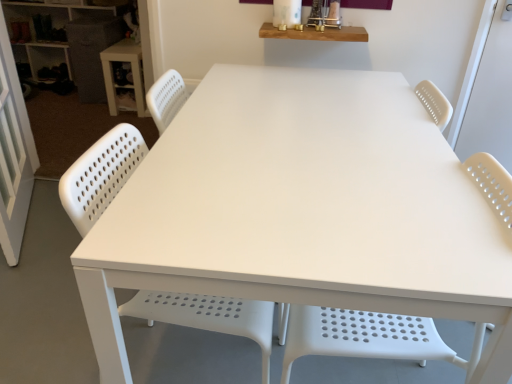
Question: Considering the relative sizes of matte white shelves at upper left and white perforated plastic chair at lower left, which is the second chair in right-to-left order, in the image provided, is matte white shelves at upper left smaller than white perforated plastic chair at lower left, which is the second chair in right-to-left order,?

Choices:
 (A) yes
 (B) no

Answer: (B)

Question: Can you see matte white shelves at upper left touching white perforated plastic chair at lower left, which is the second chair in right-to-left order?

Choices:
 (A) yes
 (B) no

Answer: (B)

Question: Is the depth of matte white shelves at upper left less than that of white perforated plastic chair at lower left, which is the second chair in right-to-left order?

Choices:
 (A) no
 (B) yes

Answer: (A)

Question: From a real-world perspective, is matte white shelves at upper left located higher than white perforated plastic chair at lower left, which is the second chair in right-to-left order?

Choices:
 (A) no
 (B) yes

Answer: (A)

Question: Does matte white shelves at upper left have a greater height compared to white perforated plastic chair at lower left, the 1th chair from the left?

Choices:
 (A) yes
 (B) no

Answer: (B)

Question: Is matte white shelves at upper left taller or shorter than white plastic table at upper left?

Choices:
 (A) tall
 (B) short

Answer: (A)

Question: Which is correct: matte white shelves at upper left is inside white plastic table at upper left, or outside of it?

Choices:
 (A) inside
 (B) outside

Answer: (B)

Question: Considering their positions, is matte white shelves at upper left located in front of or behind white plastic table at upper left?

Choices:
 (A) behind
 (B) front

Answer: (A)

Question: Does point (87, 31) appear closer or farther from the camera than point (126, 54)?

Choices:
 (A) farther
 (B) closer

Answer: (A)

Question: Is white perforated plastic chair at lower left, the 1th chair from the left, wider or thinner than white plastic table at upper left?

Choices:
 (A) wide
 (B) thin

Answer: (A)

Question: Looking at the image, does white perforated plastic chair at lower left, the 1th chair from the left, seem bigger or smaller compared to white plastic table at upper left?

Choices:
 (A) small
 (B) big

Answer: (B)

Question: From their relative heights in the image, would you say white perforated plastic chair at lower left, the 1th chair from the left, is taller or shorter than white plastic table at upper left?

Choices:
 (A) tall
 (B) short

Answer: (A)

Question: In the image, is white perforated plastic chair at lower left, the 1th chair from the left, positioned in front of or behind white plastic table at upper left?

Choices:
 (A) behind
 (B) front

Answer: (B)

Question: In terms of size, does white perforated plastic chair at center, which is the 1th chair from right to left, appear bigger or smaller than white perforated plastic chair at lower left, which is the second chair in right-to-left order?

Choices:
 (A) small
 (B) big

Answer: (A)

Question: Considering the positions of white perforated plastic chair at center, which is the 1th chair from right to left, and white perforated plastic chair at lower left, which is the second chair in right-to-left order, in the image, is white perforated plastic chair at center, which is the 1th chair from right to left, taller or shorter than white perforated plastic chair at lower left, which is the second chair in right-to-left order,?

Choices:
 (A) tall
 (B) short

Answer: (B)